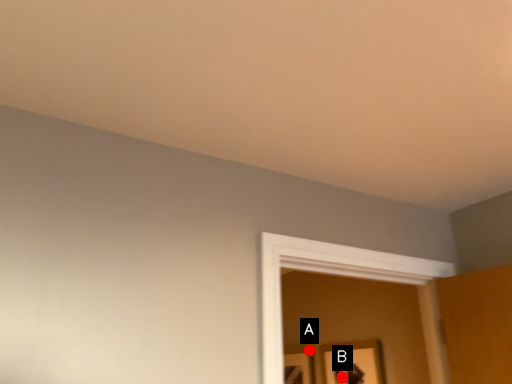
Question: Two points are circled on the image, labeled by A and B beside each circle. Among these points, which one is nearest to the camera?

Choices:
 (A) A is closer
 (B) B is closer

Answer: (B)